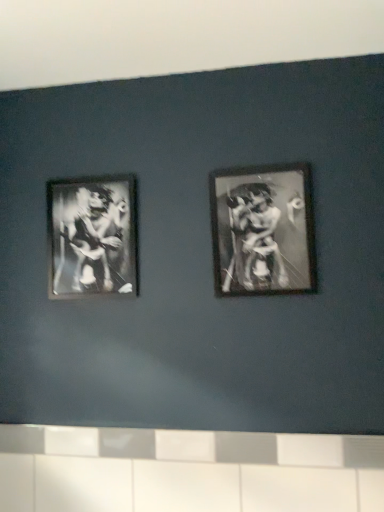
Question: From a real-world perspective, is metallic silver frame at center right, which ranks as the 1th picture frame in right-to-left order, on top of metallic silver frame at left, which is the 2th picture frame from front to back?

Choices:
 (A) yes
 (B) no

Answer: (B)

Question: Does metallic silver frame at center right, arranged as the first picture frame when viewed from the front, turn towards metallic silver frame at left, marked as the 1th picture frame in a left-to-right arrangement?

Choices:
 (A) yes
 (B) no

Answer: (B)

Question: From a real-world perspective, is metallic silver frame at center right, the 2th picture frame viewed from the left, beneath metallic silver frame at left, marked as the 1th picture frame in a left-to-right arrangement?

Choices:
 (A) yes
 (B) no

Answer: (A)

Question: Can you confirm if metallic silver frame at center right, arranged as the first picture frame when viewed from the front, is taller than metallic silver frame at left, positioned as the 2th picture frame in right-to-left order?

Choices:
 (A) yes
 (B) no

Answer: (A)

Question: From the image's perspective, is metallic silver frame at center right, arranged as the first picture frame when viewed from the front, on top of metallic silver frame at left, which is the 2th picture frame from front to back?

Choices:
 (A) no
 (B) yes

Answer: (B)

Question: Relative to metallic silver frame at left, marked as the 1th picture frame in a left-to-right arrangement, is metallic silver frame at center right, arranged as the first picture frame when viewed from the front, in front or behind?

Choices:
 (A) front
 (B) behind

Answer: (A)

Question: Does point (248, 263) appear closer or farther from the camera than point (69, 238)?

Choices:
 (A) closer
 (B) farther

Answer: (A)

Question: Which is correct: metallic silver frame at center right, the 2th picture frame viewed from the left, is inside metallic silver frame at left, which is the 2th picture frame from front to back, or outside of it?

Choices:
 (A) outside
 (B) inside

Answer: (A)

Question: From a real-world perspective, relative to metallic silver frame at left, which appears as the first picture frame when viewed from the back, is metallic silver frame at center right, which ranks as the 1th picture frame in right-to-left order, vertically above or below?

Choices:
 (A) above
 (B) below

Answer: (B)

Question: In terms of width, does metallic silver frame at center right, arranged as the first picture frame when viewed from the front, look wider or thinner when compared to white glossy tile at lower center?

Choices:
 (A) thin
 (B) wide

Answer: (B)

Question: Is point (294, 244) closer or farther from the camera than point (36, 437)?

Choices:
 (A) closer
 (B) farther

Answer: (A)

Question: In terms of size, does metallic silver frame at center right, which ranks as the 1th picture frame in right-to-left order, appear bigger or smaller than white glossy tile at lower center?

Choices:
 (A) small
 (B) big

Answer: (A)

Question: Would you say metallic silver frame at center right, which ranks as the 2th picture frame in back-to-front order, is to the left or to the right of white glossy tile at lower center in the picture?

Choices:
 (A) left
 (B) right

Answer: (B)

Question: Is white glossy tile at lower center inside the boundaries of metallic silver frame at center right, which ranks as the 1th picture frame in right-to-left order, or outside?

Choices:
 (A) outside
 (B) inside

Answer: (A)

Question: Is point (322, 497) positioned closer to the camera than point (294, 226)?

Choices:
 (A) closer
 (B) farther

Answer: (A)